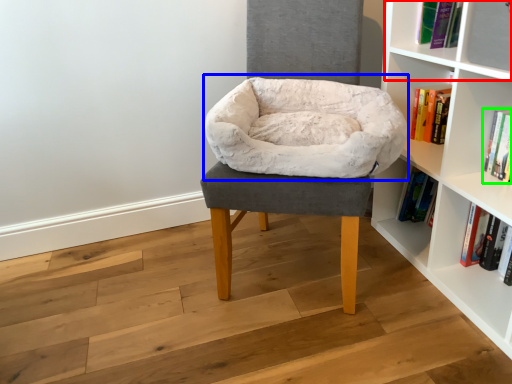
Question: Considering the real-world distances, which object is farthest from cabinet (highlighted by a red box)? bean bag chair (highlighted by a blue box) or book (highlighted by a green box)?

Choices:
 (A) bean bag chair
 (B) book

Answer: (A)